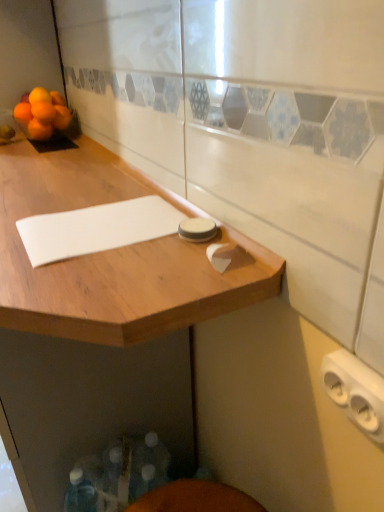
Question: Would you say orange matte at left, arranged as the fourth orange when viewed from the right, contains orange matte at upper left, which ranks as the first orange in right-to-left order?

Choices:
 (A) no
 (B) yes

Answer: (A)

Question: Does orange matte at left, positioned as the first orange in left-to-right order, have a lesser width compared to orange matte at upper left, the 4th orange in the left-to-right sequence?

Choices:
 (A) no
 (B) yes

Answer: (A)

Question: Is orange matte at left, positioned as the first orange in left-to-right order, taller than orange matte at upper left, which ranks as the first orange in right-to-left order?

Choices:
 (A) yes
 (B) no

Answer: (B)

Question: Can you confirm if orange matte at left, positioned as the first orange in left-to-right order, is positioned to the left of orange matte at upper left, the 4th orange in the left-to-right sequence?

Choices:
 (A) yes
 (B) no

Answer: (A)

Question: From the image's perspective, is orange matte at left, arranged as the fourth orange when viewed from the right, below orange matte at upper left, which ranks as the first orange in right-to-left order?

Choices:
 (A) yes
 (B) no

Answer: (B)

Question: Looking at the image, does orange matte at left, positioned as the first orange in left-to-right order, seem bigger or smaller compared to orange matte at upper left, the 4th orange in the left-to-right sequence?

Choices:
 (A) big
 (B) small

Answer: (A)

Question: From the image's perspective, relative to orange matte at upper left, the 4th orange in the left-to-right sequence, is orange matte at left, arranged as the fourth orange when viewed from the right, above or below?

Choices:
 (A) below
 (B) above

Answer: (B)

Question: Considering the positions of orange matte at left, arranged as the fourth orange when viewed from the right, and orange matte at upper left, which ranks as the first orange in right-to-left order, in the image, is orange matte at left, arranged as the fourth orange when viewed from the right, taller or shorter than orange matte at upper left, which ranks as the first orange in right-to-left order,?

Choices:
 (A) short
 (B) tall

Answer: (A)

Question: Do you think orange matte at left, positioned as the first orange in left-to-right order, is within orange matte at upper left, the 4th orange in the left-to-right sequence, or outside of it?

Choices:
 (A) inside
 (B) outside

Answer: (B)

Question: Is white plastic outlet at lower right in front of or behind orange matte at upper left, acting as the third orange starting from the right, in the image?

Choices:
 (A) behind
 (B) front

Answer: (B)

Question: From a real-world perspective, relative to orange matte at upper left, positioned as the second orange in left-to-right order, is white plastic outlet at lower right vertically above or below?

Choices:
 (A) below
 (B) above

Answer: (A)

Question: Is point (360, 387) positioned closer to the camera than point (49, 123)?

Choices:
 (A) farther
 (B) closer

Answer: (B)

Question: Would you say white plastic outlet at lower right is inside or outside orange matte at upper left, acting as the third orange starting from the right?

Choices:
 (A) inside
 (B) outside

Answer: (B)

Question: Considering the positions of white plastic outlet at lower right and orange matte at upper left, which ranks as the first orange in right-to-left order, in the image, is white plastic outlet at lower right wider or thinner than orange matte at upper left, which ranks as the first orange in right-to-left order,?

Choices:
 (A) wide
 (B) thin

Answer: (B)

Question: Is white plastic outlet at lower right spatially inside orange matte at upper left, the 4th orange in the left-to-right sequence, or outside of it?

Choices:
 (A) outside
 (B) inside

Answer: (A)